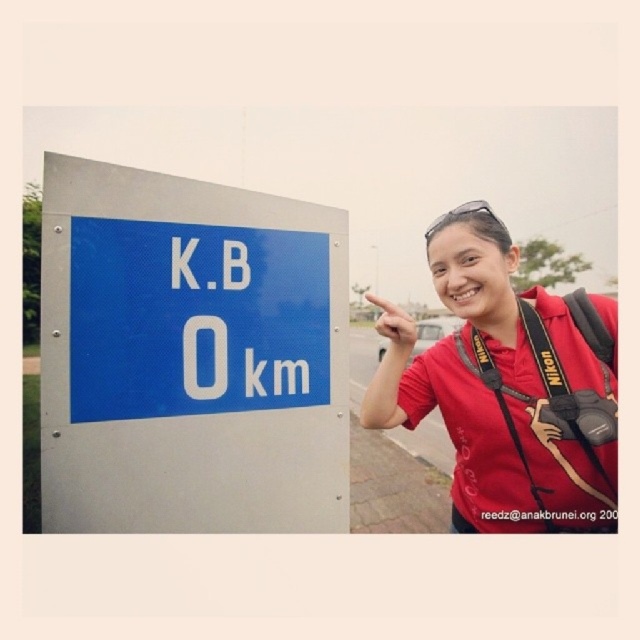
Between point (605, 300) and point (444, 212), which one is positioned behind?

Point (444, 212)

Who is shorter, matte red shirt at center or clear plastic goggles at upper center?

matte red shirt at center

Who is more forward, (x=438, y=250) or (x=445, y=212)?

Point (x=438, y=250) is in front.

Locate an element on the screen. This screenshot has width=640, height=640. matte red shirt at center is located at coordinates (508, 388).

Is blue glossy sign at left below clear plastic goggles at upper center?

Yes, blue glossy sign at left is below clear plastic goggles at upper center.

Is blue glossy sign at left in front of clear plastic goggles at upper center?

Yes, it is.

The width and height of the screenshot is (640, 640). What are the coordinates of `blue glossy sign at left` in the screenshot? It's located at (189, 355).

Is point (51, 528) closer to camera compared to point (422, 358)?

That is True.

In order to click on blue glossy sign at left in this screenshot , I will do `click(189, 355)`.

Who is more forward, (204, 192) or (596, 376)?

Point (596, 376) is more forward.

Locate an element on the screen. blue glossy sign at left is located at coordinates point(189,355).